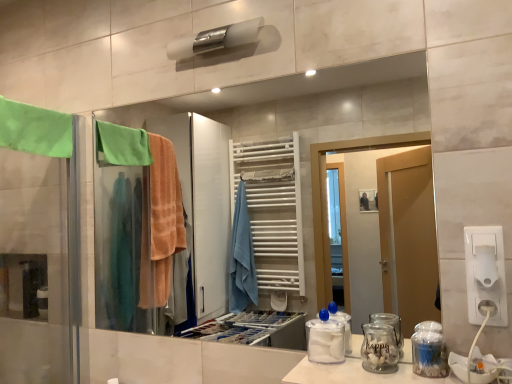
In order to click on vacant position to the left of clear plastic jar at lower right, positioned as the first glass jar in right-to-left order in this screenshot , I will do `click(362, 374)`.